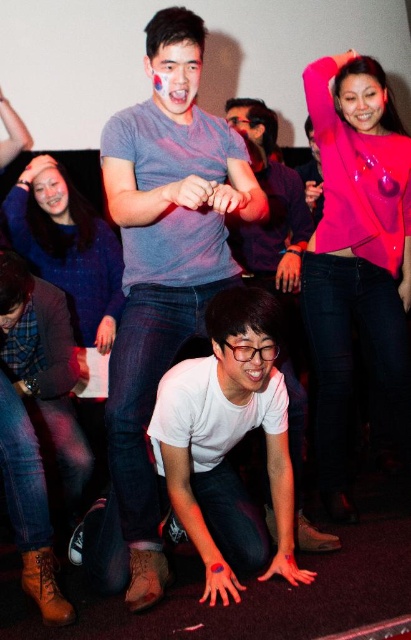
Question: Does gray cotton t-shirt at center have a lesser width compared to white matte shirt at center?

Choices:
 (A) yes
 (B) no

Answer: (A)

Question: Which point appears closest to the camera in this image?

Choices:
 (A) (122, 394)
 (B) (256, 161)
 (C) (239, 426)

Answer: (A)

Question: Which is farther from the white matte shirt at center?

Choices:
 (A) gray cotton t-shirt at center
 (B) white matte t-shirt at lower center

Answer: (B)

Question: Which point is farther to the camera?

Choices:
 (A) white matte shirt at center
 (B) gray cotton t-shirt at center

Answer: (A)

Question: Can you confirm if white matte shirt at center is positioned to the right of white matte t-shirt at lower center?

Choices:
 (A) no
 (B) yes

Answer: (A)

Question: Is gray cotton t-shirt at center to the right of white matte shirt at center from the viewer's perspective?

Choices:
 (A) yes
 (B) no

Answer: (B)